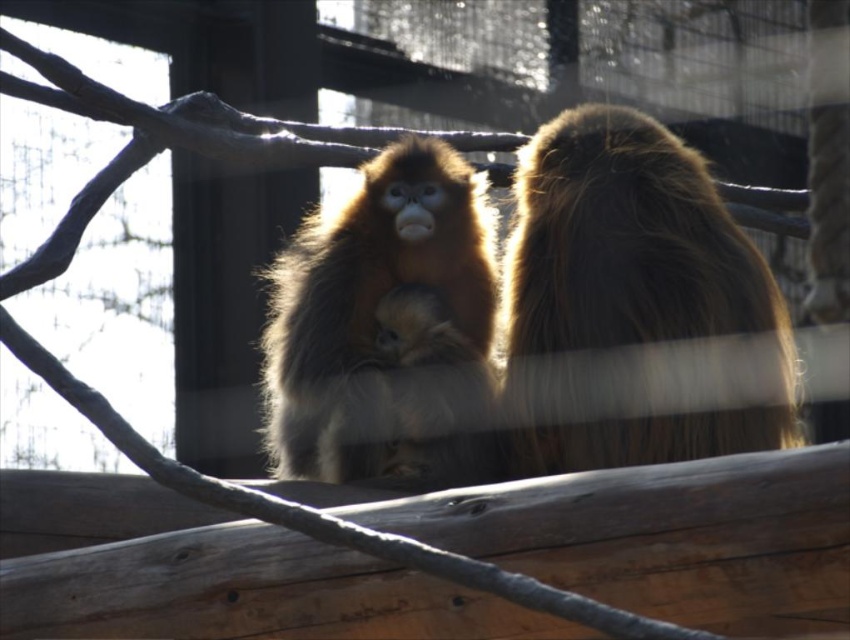
Is fuzzy brown monkey at right bigger than golden fur monkey at center?

Correct, fuzzy brown monkey at right is larger in size than golden fur monkey at center.

Is point (642, 320) farther from viewer compared to point (412, 307)?

That is False.

Where is `fuzzy brown monkey at right`? fuzzy brown monkey at right is located at coordinates (633, 305).

Can you confirm if fuzzy brown monkey at right is positioned to the right of fuzzy golden monkey at center?

Indeed, fuzzy brown monkey at right is positioned on the right side of fuzzy golden monkey at center.

Is fuzzy brown monkey at right to the left of fuzzy golden monkey at center from the viewer's perspective?

Incorrect, fuzzy brown monkey at right is not on the left side of fuzzy golden monkey at center.

Where is `fuzzy brown monkey at right`? The width and height of the screenshot is (850, 640). fuzzy brown monkey at right is located at coordinates (633, 305).

Can you confirm if golden fur monkey at center is taller than fuzzy golden monkey at center?

Correct, golden fur monkey at center is much taller as fuzzy golden monkey at center.

Looking at this image, does golden fur monkey at center appear on the right side of fuzzy golden monkey at center?

Incorrect, golden fur monkey at center is not on the right side of fuzzy golden monkey at center.

The width and height of the screenshot is (850, 640). I want to click on golden fur monkey at center, so click(388, 330).